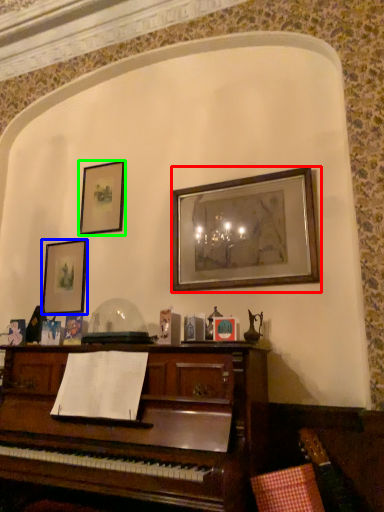
Question: Which is farther away from picture frame (highlighted by a red box)? picture frame (highlighted by a blue box) or picture frame (highlighted by a green box)?

Choices:
 (A) picture frame
 (B) picture frame

Answer: (A)